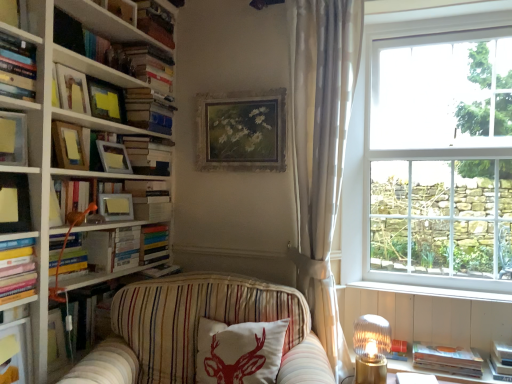
Question: Would you say hardcover books at upper left, which ranks as the 5th book in top-to-bottom order, is inside or outside orange fabric lamp at left, marked as the first lamp in a front-to-back arrangement?

Choices:
 (A) outside
 (B) inside

Answer: (A)

Question: Looking at the image, does hardcover books at upper left, which ranks as the 5th book in top-to-bottom order, seem bigger or smaller compared to orange fabric lamp at left, the second lamp in the right-to-left sequence?

Choices:
 (A) small
 (B) big

Answer: (B)

Question: Which is nearer to the matte yellow book at left, the sixth book when ordered from top to bottom?

Choices:
 (A) matte white picture frame at upper left, marked as the 2th picture frame in a right-to-left arrangement
 (B) hardcover book at upper left, positioned as the 2th book in top-to-bottom order
 (C) matte yellow picture frame at upper left, arranged as the fourth picture frame when viewed from the right
 (D) hardcover book at lower right, positioned as the twelfth book in top-to-bottom order
 (E) white wood at lower right

Answer: (C)

Question: Which object is the closest to the translucent glass lampshade at lower right, the 2th lamp viewed from the left?

Choices:
 (A) matte white picture frame at upper left, arranged as the 5th picture frame when viewed from the left
 (B) striped fabric couch at center
 (C) white sheer curtain at right
 (D) hardcover book at upper left, positioned as the 2th book in top-to-bottom order
 (E) white wood at lower right

Answer: (E)